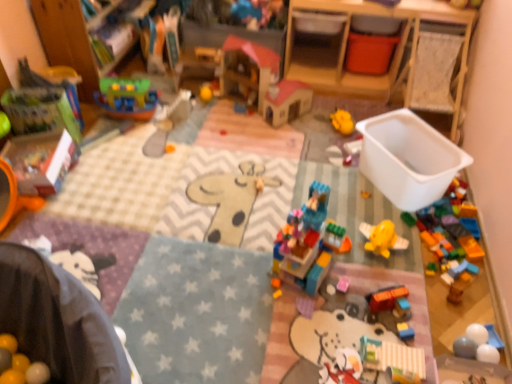
Find the location of `unoccupied area in front of wooden changing table at upper right`. unoccupied area in front of wooden changing table at upper right is located at coordinates (328, 127).